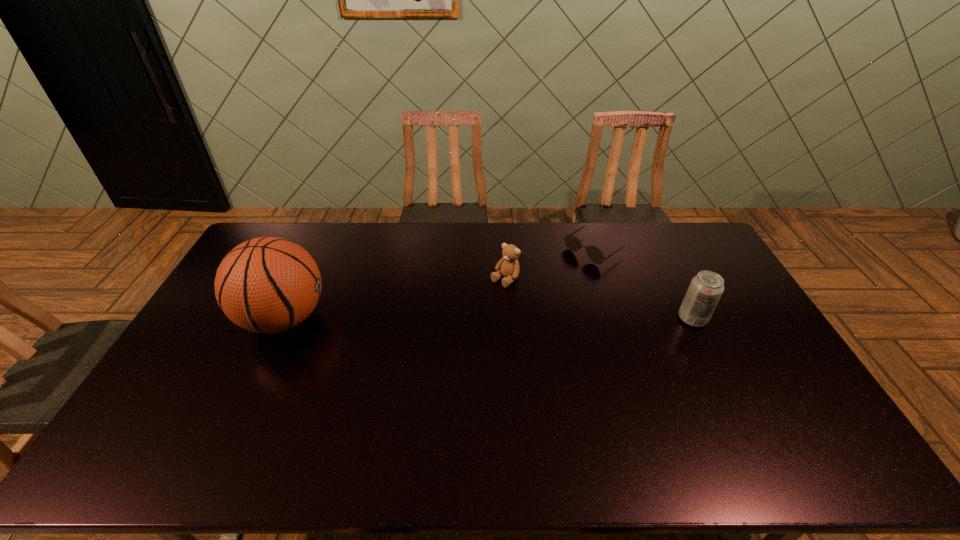
This screenshot has height=540, width=960. I want to click on free space located on the front-facing side of the farthest object, so click(x=548, y=281).

Find the location of a particular element. Image resolution: width=960 pixels, height=540 pixels. free location located 0.400m on the front-facing side of the farthest object is located at coordinates (498, 316).

In order to click on free spot located on the front-facing side of the farthest object in this screenshot , I will do `click(544, 284)`.

Identify the location of vacant space situated 0.250m on the face of the teddy bear. (449, 330).

You are a GUI agent. You are given a task and a screenshot of the screen. Output one action in this format:
    pyautogui.click(x=<x>, y=<y>)
    Task: Click on the free spot located 0.070m on the face of the teddy bear
    The height and width of the screenshot is (540, 960).
    Given the screenshot: What is the action you would take?
    pyautogui.click(x=484, y=299)

Locate an element on the screen. The image size is (960, 540). free space located 0.080m on the face of the teddy bear is located at coordinates (483, 300).

Where is `object that is at the far edge`? object that is at the far edge is located at coordinates (572, 243).

Image resolution: width=960 pixels, height=540 pixels. I want to click on object that is positioned at the left edge, so click(268, 285).

At what (x,y) coordinates should I click in order to perform the action: click on object present at the right edge. Please return your answer as a coordinate pair (x, y). This screenshot has width=960, height=540. Looking at the image, I should click on (706, 288).

Where is `blank space at the far edge`? The width and height of the screenshot is (960, 540). blank space at the far edge is located at coordinates (623, 251).